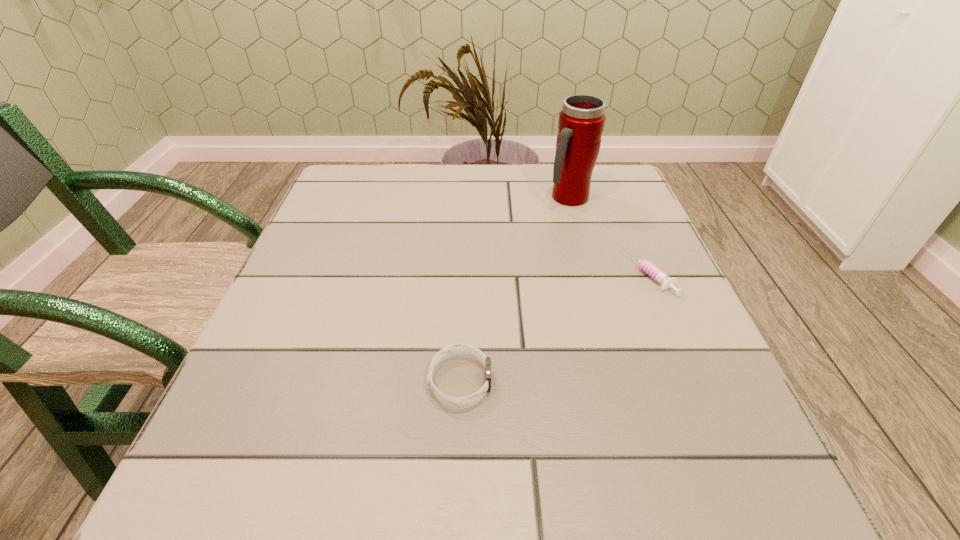
The height and width of the screenshot is (540, 960). I want to click on object that is the closest to the rightmost object, so click(581, 122).

Where is `free space that satisfies the following two spatial constraints: 1. on the side with the handle of the second object from right to left; 2. on the outer surface of the nearest object`? free space that satisfies the following two spatial constraints: 1. on the side with the handle of the second object from right to left; 2. on the outer surface of the nearest object is located at coordinates (619, 381).

Locate an element on the screen. The height and width of the screenshot is (540, 960). vacant region that satisfies the following two spatial constraints: 1. on the side with the handle of the tallest object; 2. on the left side of the syringe is located at coordinates (589, 274).

The image size is (960, 540). I want to click on vacant space that satisfies the following two spatial constraints: 1. on the side with the handle of the thermos bottle; 2. on the outer surface of the wristband, so (x=619, y=381).

The image size is (960, 540). What are the coordinates of `free space that satisfies the following two spatial constraints: 1. on the side with the handle of the second object from left to right; 2. on the right side of the shortest object` in the screenshot? It's located at (589, 274).

What are the coordinates of `free space that satisfies the following two spatial constraints: 1. on the side with the handle of the rightmost object; 2. on the right side of the farthest object` in the screenshot? It's located at (589, 274).

Where is `vacant position in the image that satisfies the following two spatial constraints: 1. on the side with the handle of the tallest object; 2. on the right side of the shortest object`? vacant position in the image that satisfies the following two spatial constraints: 1. on the side with the handle of the tallest object; 2. on the right side of the shortest object is located at coordinates (589, 274).

In order to click on free location that satisfies the following two spatial constraints: 1. on the front side of the syringe; 2. on the outer surface of the second tallest object in this screenshot , I will do `click(695, 381)`.